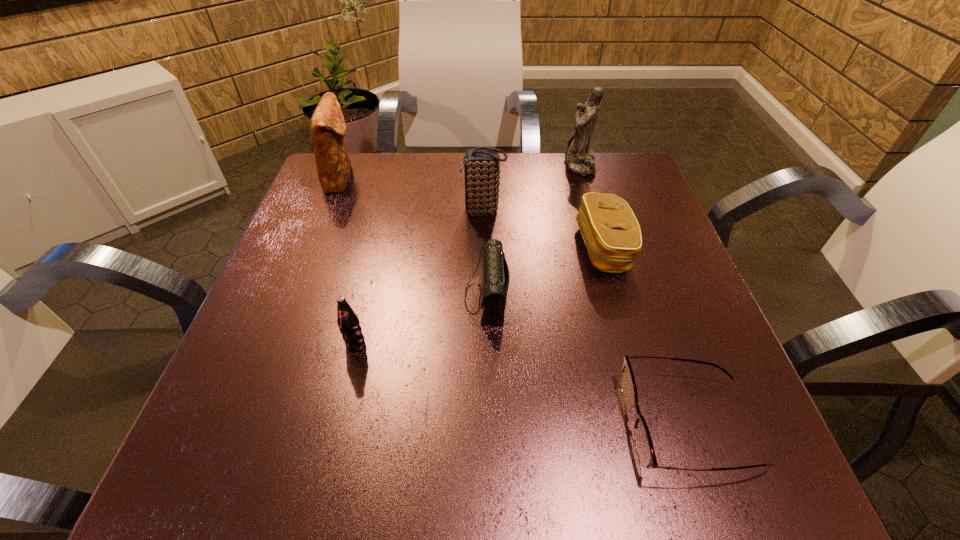
The image size is (960, 540). I want to click on object that is at the far left corner, so click(x=328, y=127).

The height and width of the screenshot is (540, 960). What are the coordinates of `object that is at the far right corner` in the screenshot? It's located at (579, 157).

Image resolution: width=960 pixels, height=540 pixels. What are the coordinates of `object at the near right corner` in the screenshot? It's located at click(x=644, y=446).

Identify the location of vacant area at the far edge. The image size is (960, 540). (530, 165).

The width and height of the screenshot is (960, 540). In the image, there is a desktop. Find the location of `vacant space at the left edge`. vacant space at the left edge is located at coordinates (350, 220).

Find the location of `free region at the right edge of the desktop`. free region at the right edge of the desktop is located at coordinates (704, 392).

The width and height of the screenshot is (960, 540). I want to click on vacant region at the far right corner, so pos(653,208).

Image resolution: width=960 pixels, height=540 pixels. Find the location of `vacant point at the near right corner`. vacant point at the near right corner is located at coordinates (721, 457).

Identify the location of empty space between the rightmost clutch bag and the nearest object. (646, 336).

Identify the location of free area in between the pop and the figurine. (468, 254).